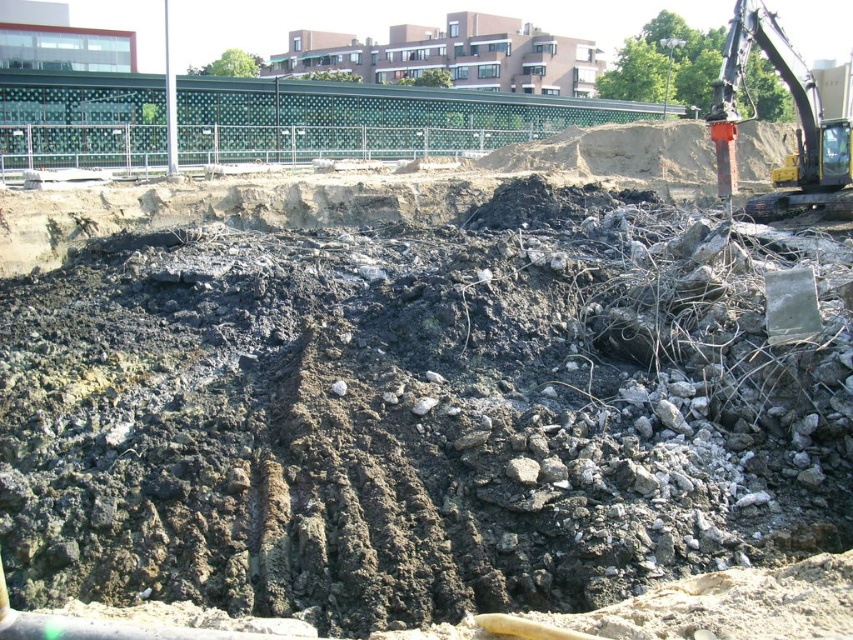
Question: Which point is farther to the camera?

Choices:
 (A) (633, 166)
 (B) (303, 456)
 (C) (801, 166)

Answer: (A)

Question: Does yellow metallic excavator at upper right appear under rusty metal pile at upper right?

Choices:
 (A) yes
 (B) no

Answer: (A)

Question: Among these objects, which one is farthest from the camera?

Choices:
 (A) yellow metallic excavator at upper right
 (B) dull brown soil at center
 (C) rusty metal pile at upper right

Answer: (C)

Question: Does yellow metallic excavator at upper right have a smaller size compared to rusty metal pile at upper right?

Choices:
 (A) no
 (B) yes

Answer: (A)

Question: Considering the real-world distances, which object is closest to the rusty metal pile at upper right?

Choices:
 (A) dull brown soil at center
 (B) yellow metallic excavator at upper right

Answer: (B)

Question: Can you confirm if yellow metallic excavator at upper right is bigger than rusty metal pile at upper right?

Choices:
 (A) no
 (B) yes

Answer: (B)